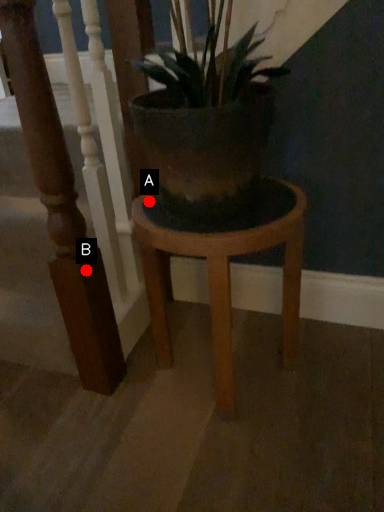
Question: Two points are circled on the image, labeled by A and B beside each circle. Which point appears closest to the camera in this image?

Choices:
 (A) A is closer
 (B) B is closer

Answer: (A)